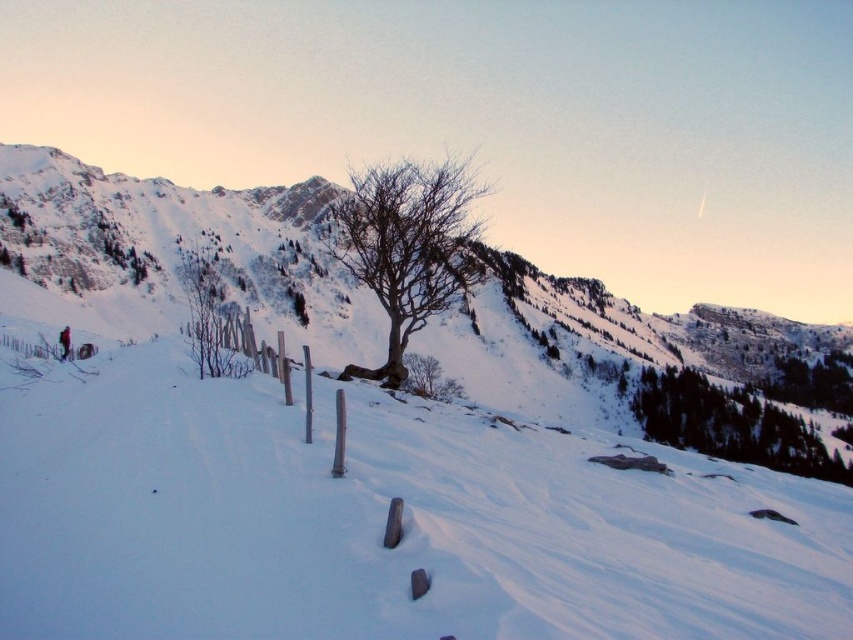
Which is behind, point (772, 481) or point (202, 289)?

Point (202, 289)

Is white snow at center smaller than brown/rough tree at center-left?

Yes.

What do you see at coordinates (379, 522) in the screenshot? The height and width of the screenshot is (640, 853). I see `white snow at center` at bounding box center [379, 522].

Identify the location of white snow at center. The height and width of the screenshot is (640, 853). (379, 522).

Does white snow at center appear on the right side of bare wood tree at center?

Indeed, white snow at center is positioned on the right side of bare wood tree at center.

Which is above, white snow at center or bare wood tree at center?

bare wood tree at center is above.

Who is more forward, (717, 586) or (416, 288)?

Point (717, 586) is in front.

Locate an element on the screen. This screenshot has width=853, height=640. white snow at center is located at coordinates click(x=379, y=522).

Is point (440, 170) behind point (196, 252)?

No, it is in front of (196, 252).

Who is higher up, bare wood tree at center or brown/rough tree at center-left?

bare wood tree at center

In order to click on bare wood tree at center in this screenshot , I will do `click(408, 246)`.

At what (x,y) coordinates should I click in order to perform the action: click on bare wood tree at center. Please return your answer as a coordinate pair (x, y). Image resolution: width=853 pixels, height=640 pixels. Looking at the image, I should click on (408, 246).